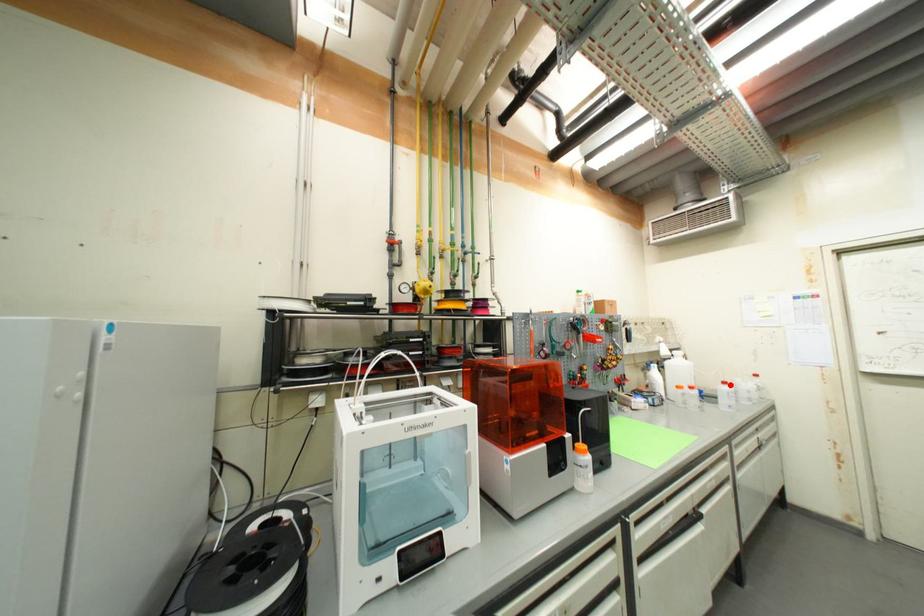
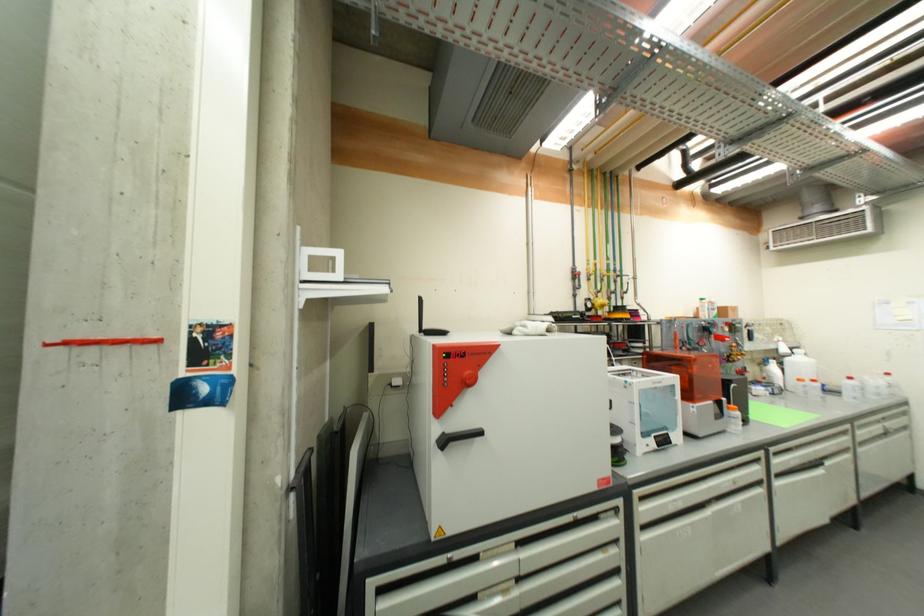
Locate, in the second image, the point that corresponds to the highlighted location in the first image.

(856, 379)